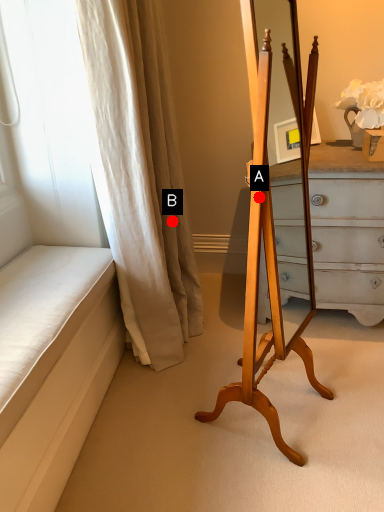
Question: Two points are circled on the image, labeled by A and B beside each circle. Which point is closer to the camera?

Choices:
 (A) A is closer
 (B) B is closer

Answer: (A)